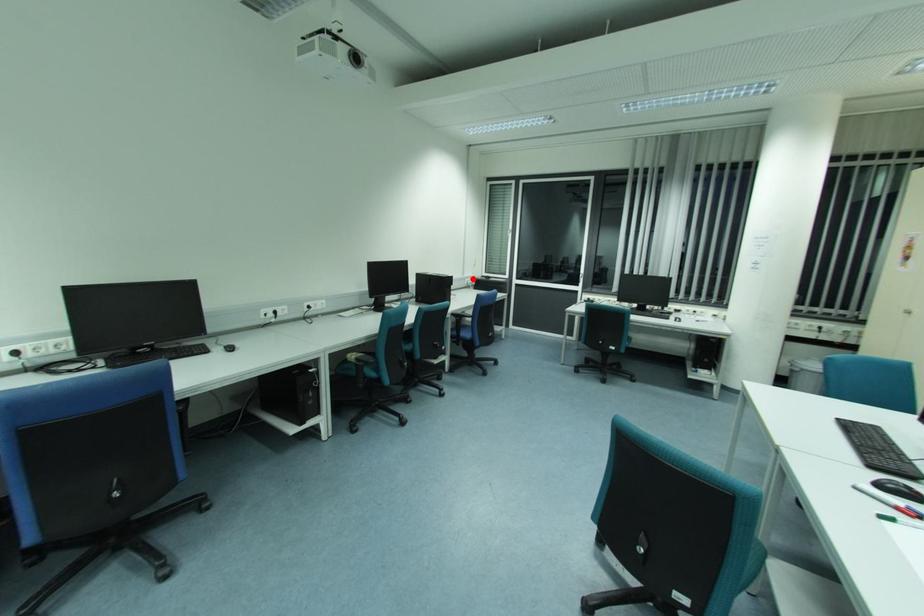
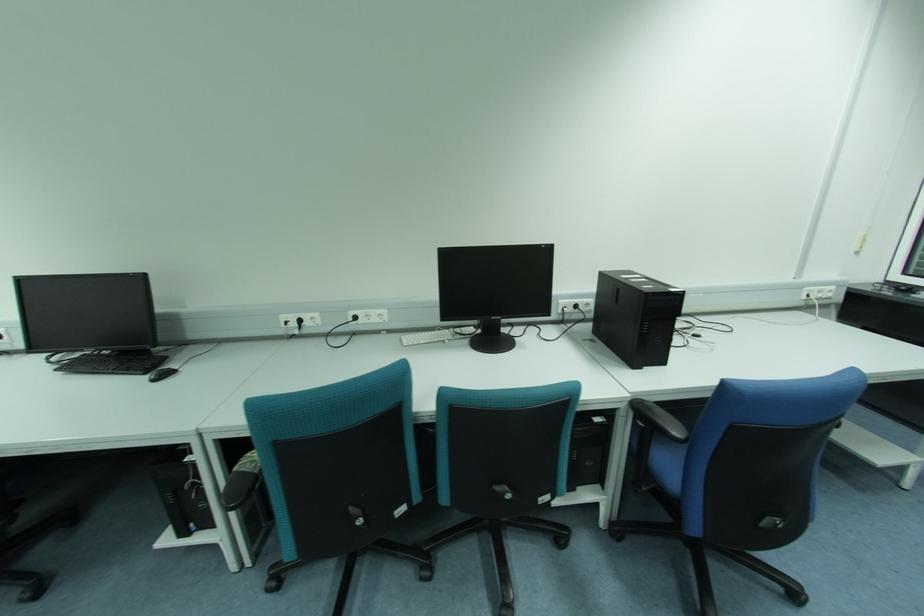
Question: I am providing you with two images of the same scene from different viewpoints. In image1, a red point is highlighted. Considering the same 3D point in image2, which of the following is correct?

Choices:
 (A) It is closer
 (B) It is farther

Answer: (B)